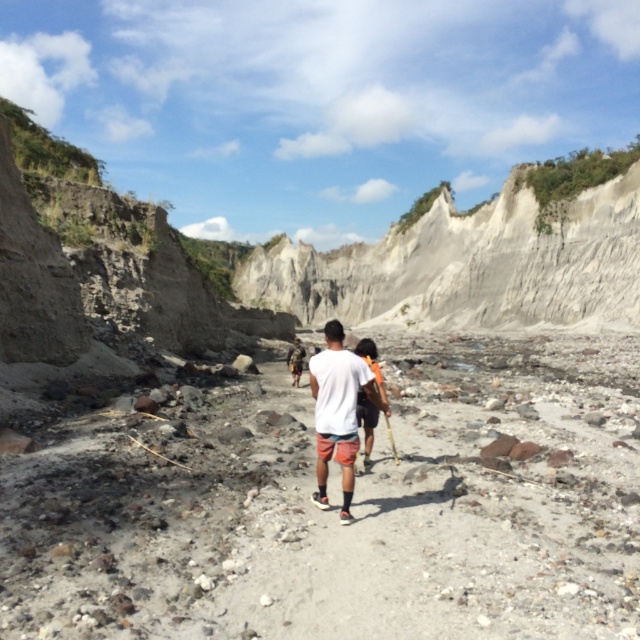
Question: Which point is closer to the camera?

Choices:
 (A) white matte shirt at center
 (B) gray gravel trail at center

Answer: (B)

Question: Can you confirm if gray gravel trail at center is thinner than white matte shirt at center?

Choices:
 (A) yes
 (B) no

Answer: (B)

Question: Can you confirm if gray gravel trail at center is smaller than white matte shirt at center?

Choices:
 (A) no
 (B) yes

Answer: (A)

Question: Considering the relative positions of gray gravel trail at center and white matte shirt at center in the image provided, where is gray gravel trail at center located with respect to white matte shirt at center?

Choices:
 (A) above
 (B) below

Answer: (B)

Question: Which point is farther to the camera?

Choices:
 (A) gray gravel trail at center
 (B) white matte shirt at center

Answer: (B)

Question: Which of the following is the farthest from the observer?

Choices:
 (A) (44, 634)
 (B) (358, 378)

Answer: (B)